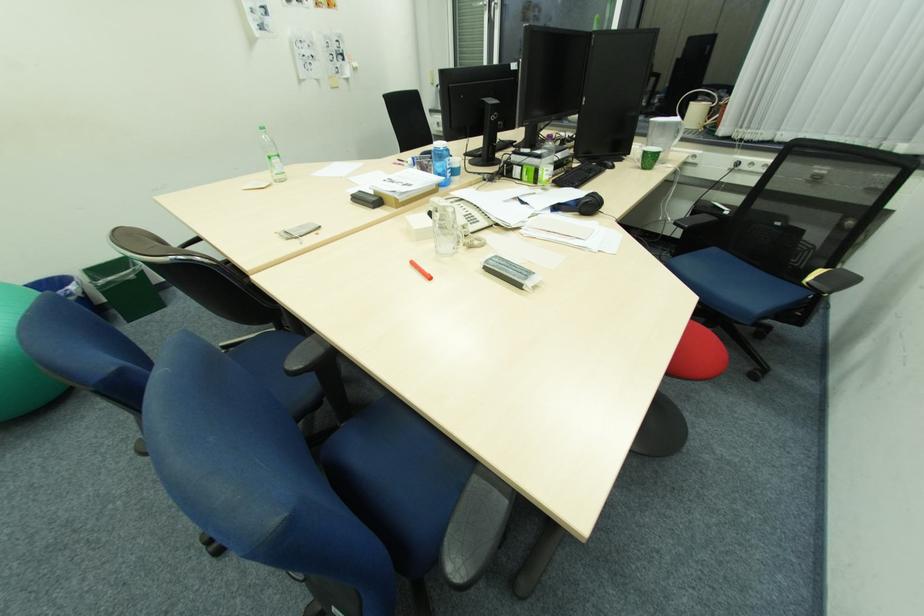
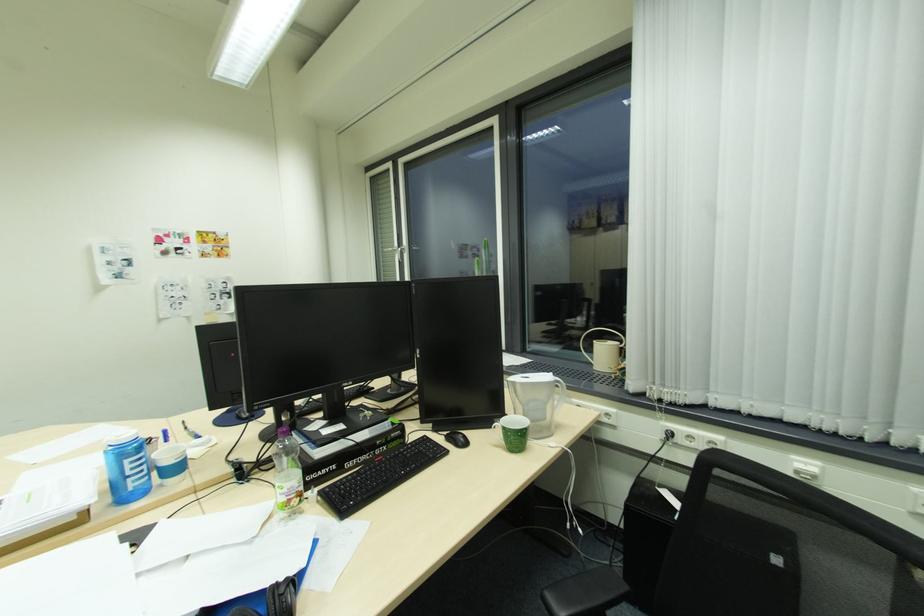
In the second image, find the point that corresponds to pixel 552 169 in the first image.

(286, 485)